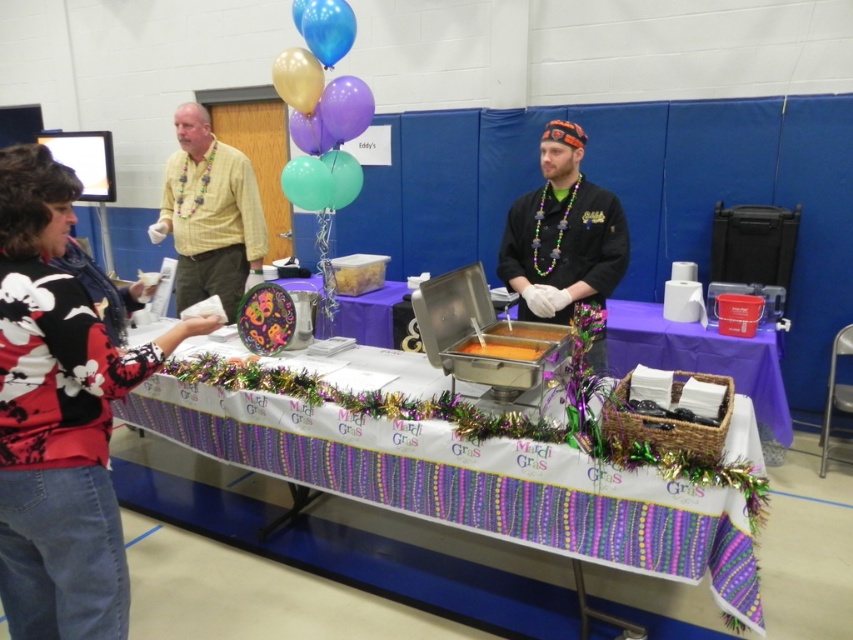
Question: Does purple matte balloon at upper center appear on the right side of gold metallic balloon at upper center?

Choices:
 (A) yes
 (B) no

Answer: (A)

Question: Considering the real-world distances, which object is farthest from the black chef coat at center?

Choices:
 (A) translucent glossy balloon at center
 (B) white paper tablecloth at center
 (C) blue glossy balloon at upper center
 (D) floral sweater at left

Answer: (D)

Question: Can you confirm if floral sweater at left is positioned to the right of black chef coat at center?

Choices:
 (A) no
 (B) yes

Answer: (A)

Question: Which point is closer to the camera?

Choices:
 (A) floral sweater at left
 (B) gold metallic balloon at upper center

Answer: (A)

Question: Does translucent glossy balloon at center have a greater width compared to orange plastic container at center?

Choices:
 (A) no
 (B) yes

Answer: (A)

Question: Which of the following is the closest to the observer?

Choices:
 (A) black chef coat at center
 (B) yellow striped shirt at left
 (C) white paper tablecloth at center

Answer: (C)